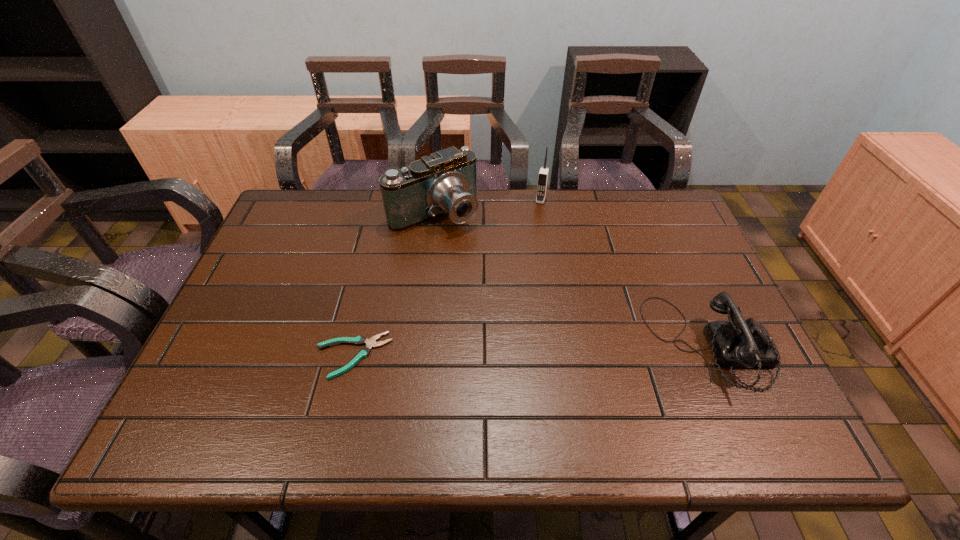
At what (x,y) coordinates should I click in order to perform the action: click on the shortest object. Please return your answer as a coordinate pair (x, y). The image size is (960, 540). Looking at the image, I should click on (359, 340).

Locate an element on the screen. The image size is (960, 540). telephone is located at coordinates (738, 343).

Find the location of `the second shortest object`. the second shortest object is located at coordinates (738, 343).

Where is `camcorder`? camcorder is located at coordinates (444, 183).

Locate an element on the screen. cellular telephone is located at coordinates (544, 171).

Where is `vacant space located on the left of the shortest object`? This screenshot has width=960, height=540. vacant space located on the left of the shortest object is located at coordinates (211, 355).

You are a GUI agent. You are given a task and a screenshot of the screen. Output one action in this format:
    pyautogui.click(x=<x>, y=<y>)
    Task: Click on the free space located 0.330m on the front-facing side of the camcorder
    
    Given the screenshot: What is the action you would take?
    pyautogui.click(x=523, y=302)

The image size is (960, 540). I want to click on vacant space located on the front-facing side of the camcorder, so click(535, 315).

You are a GUI agent. You are given a task and a screenshot of the screen. Output one action in this format:
    pyautogui.click(x=<x>, y=<y>)
    Task: Click on the vacant point located on the front-facing side of the camcorder
    
    Given the screenshot: What is the action you would take?
    pyautogui.click(x=466, y=242)

In order to click on free space located on the front-facing side of the cellular telephone in this screenshot , I will do 535,223.